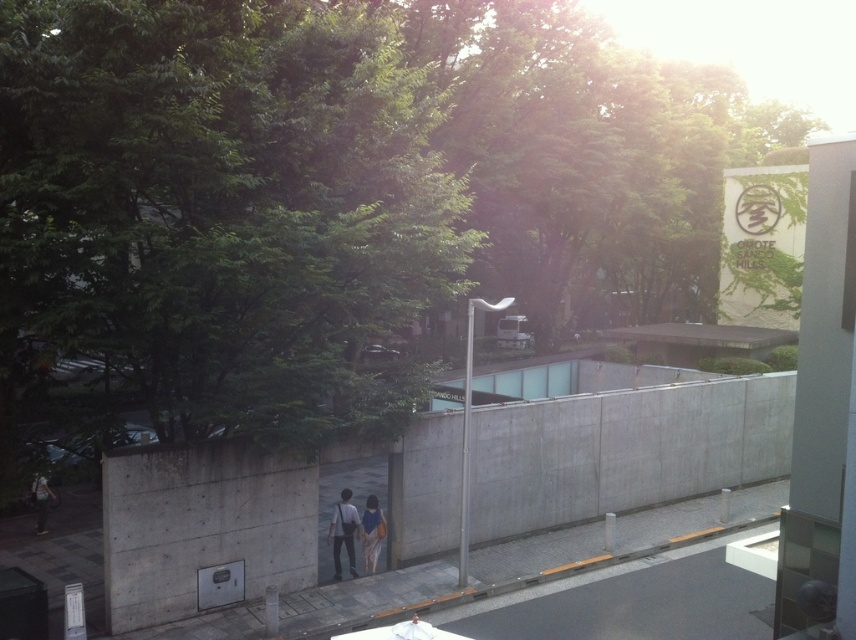
Question: Is matte blue dress at center smaller than matte black jacket at lower left?

Choices:
 (A) no
 (B) yes

Answer: (A)

Question: Which of the following is the closest to the observer?

Choices:
 (A) matte blue dress at center
 (B) blue fabric bag at center

Answer: (A)

Question: Does matte blue dress at center come behind blue fabric bag at center?

Choices:
 (A) no
 (B) yes

Answer: (A)

Question: Which object appears closest to the camera in this image?

Choices:
 (A) matte black jacket at lower left
 (B) matte blue dress at center
 (C) blue fabric bag at center

Answer: (B)

Question: Does matte blue dress at center appear on the right side of matte black jacket at lower left?

Choices:
 (A) no
 (B) yes

Answer: (B)

Question: Which of the following is the farthest from the observer?

Choices:
 (A) (348, 541)
 (B) (378, 548)
 (C) (30, 486)

Answer: (B)